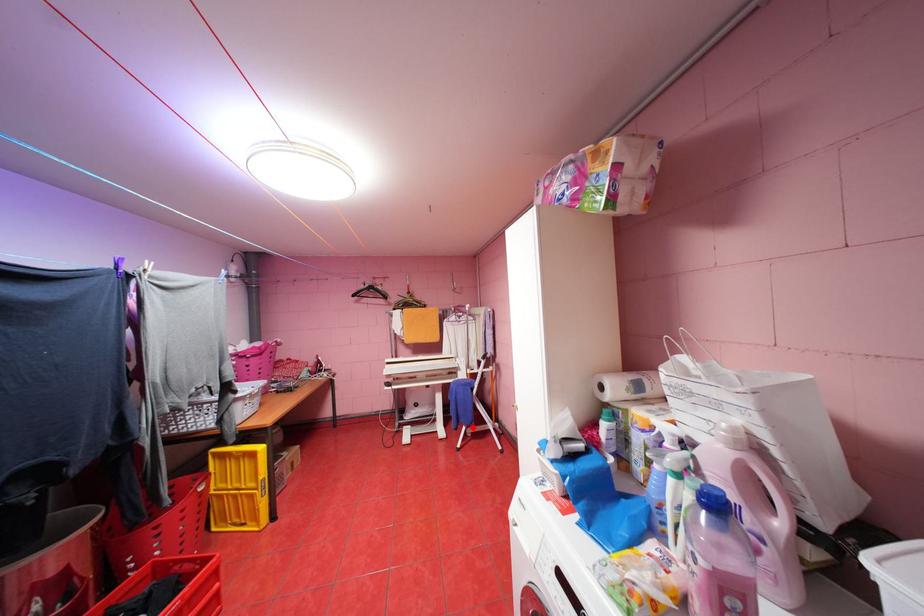
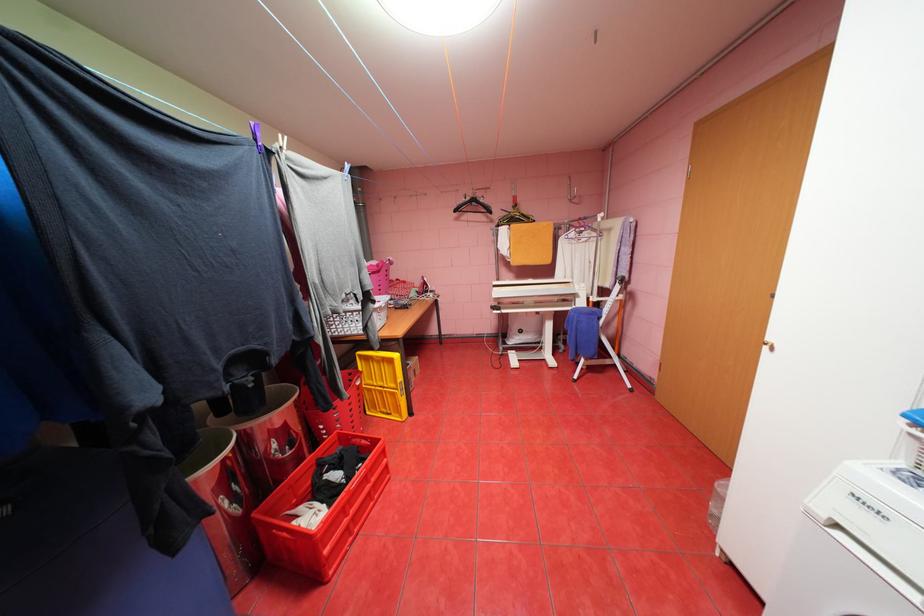
The point at the highlighted location is marked in the first image. Where is the corresponding point in the second image?

(591, 360)